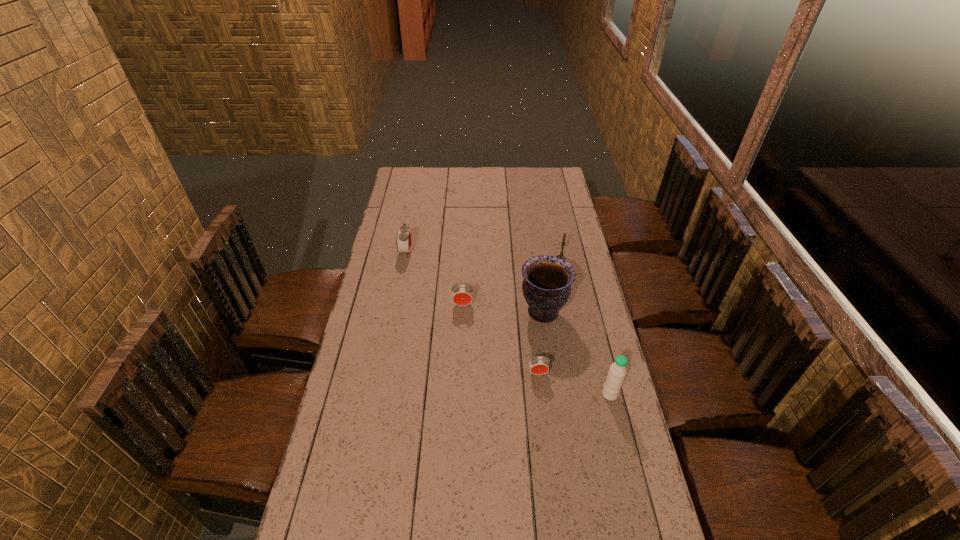
Locate an element on the screen. The width and height of the screenshot is (960, 540). vacant space located 0.120m on the face of the leftmost object is located at coordinates (439, 253).

Locate an element on the screen. The height and width of the screenshot is (540, 960). free region located 0.070m on the face of the second shortest alarm clock is located at coordinates (462, 323).

Identify the location of vacant space located on the face of the second nearest object. (549, 467).

I want to click on vacant point located on the front of the candle, so click(x=567, y=287).

This screenshot has height=540, width=960. In order to click on free space located 0.350m on the front handle of the pottery in this screenshot , I will do `click(427, 313)`.

The image size is (960, 540). Find the location of `vacant space located 0.350m on the front handle of the pottery`. vacant space located 0.350m on the front handle of the pottery is located at coordinates (427, 313).

You are a GUI agent. You are given a task and a screenshot of the screen. Output one action in this format:
    pyautogui.click(x=<x>, y=<y>)
    Task: Click on the vacant space located on the front handle of the pottery
    
    Given the screenshot: What is the action you would take?
    pyautogui.click(x=440, y=313)

I want to click on free spot located on the left of the water bottle, so click(587, 394).

In order to click on object that is at the left edge in this screenshot , I will do `click(403, 240)`.

Locate an element on the screen. This screenshot has height=540, width=960. candle that is at the right edge is located at coordinates (561, 255).